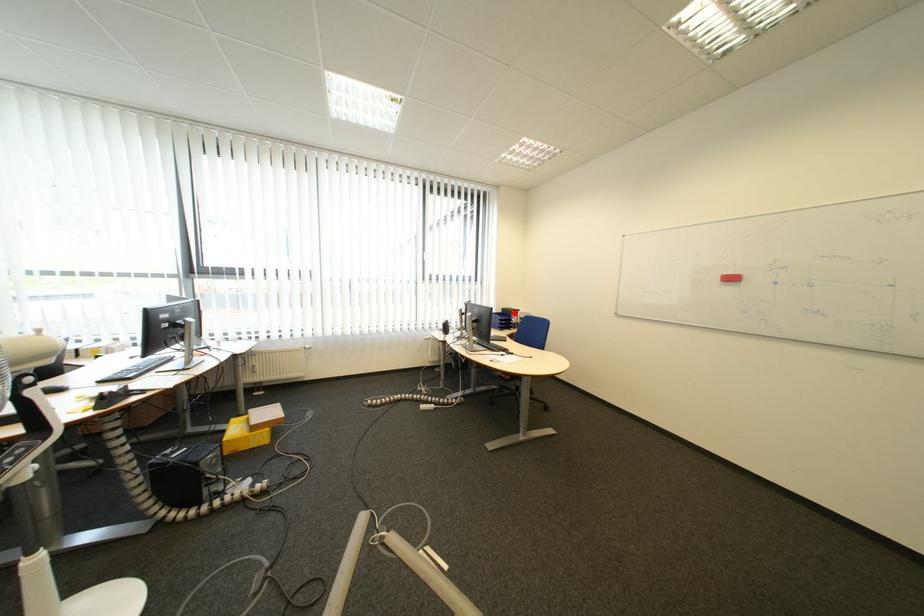
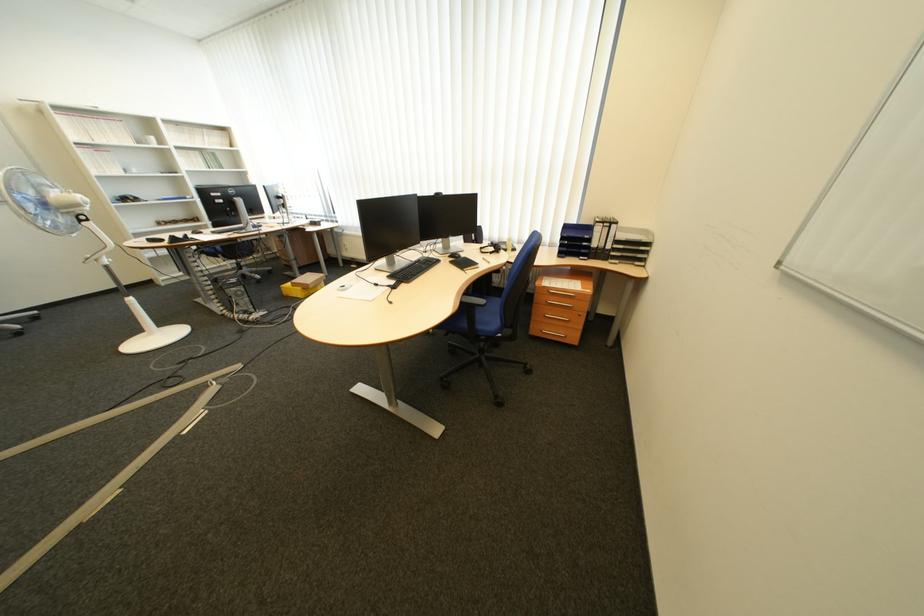
Question: I am providing you with two images of the same scene from different viewpoints. In image1, a red point is highlighted. Considering the same 3D point in image2, which of the following is correct?

Choices:
 (A) It is closer
 (B) It is farther

Answer: (A)